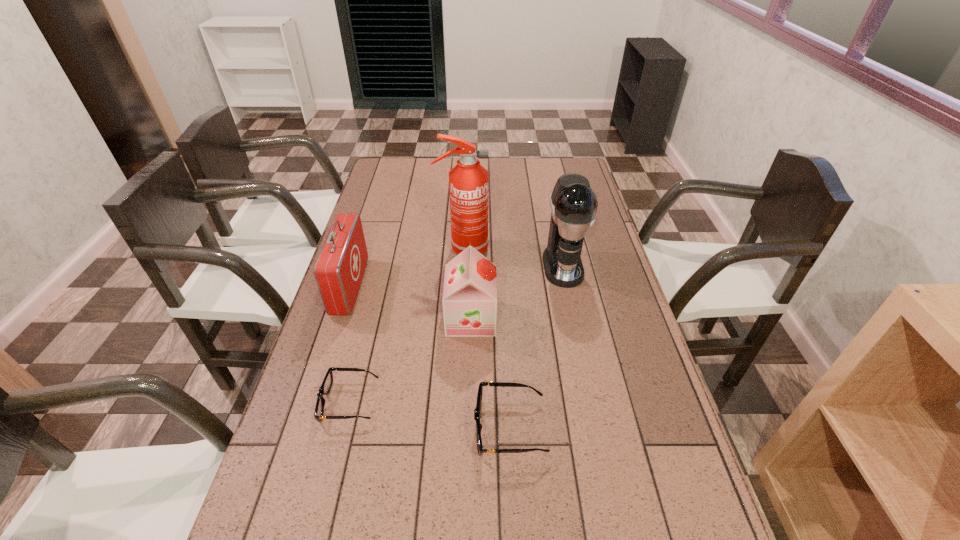
Locate an element on the screen. vacant space at the far edge of the desktop is located at coordinates (424, 158).

I want to click on free space at the near edge, so [x=602, y=517].

At what (x,y) coordinates should I click in order to perform the action: click on vacant space at the left edge. Please return your answer as a coordinate pair (x, y). Looking at the image, I should click on (387, 230).

In the image, there is a desktop. Identify the location of free region at the right edge. [627, 344].

You are a GUI agent. You are given a task and a screenshot of the screen. Output one action in this format:
    pyautogui.click(x=<x>, y=<y>)
    Task: Click on the vacant space at the far left corner of the desktop
    The height and width of the screenshot is (540, 960).
    Given the screenshot: What is the action you would take?
    pyautogui.click(x=392, y=163)

Locate an element on the screen. The width and height of the screenshot is (960, 540). vacant space at the near left corner is located at coordinates (287, 514).

Locate an element on the screen. free space at the far right corner of the desktop is located at coordinates (565, 159).

This screenshot has height=540, width=960. Find the location of `free point between the fire extinguisher and the shorter sunglasses`. free point between the fire extinguisher and the shorter sunglasses is located at coordinates (406, 326).

You are a GUI agent. You are given a task and a screenshot of the screen. Output one action in this format:
    pyautogui.click(x=<x>, y=<y>)
    Task: Click on the vacant area that lies between the shorter sunglasses and the fire extinguisher
    This screenshot has height=540, width=960.
    Given the screenshot: What is the action you would take?
    pyautogui.click(x=406, y=326)

Image resolution: width=960 pixels, height=540 pixels. What are the coordinates of `free space between the right sunglasses and the coffee maker` in the screenshot? It's located at (537, 347).